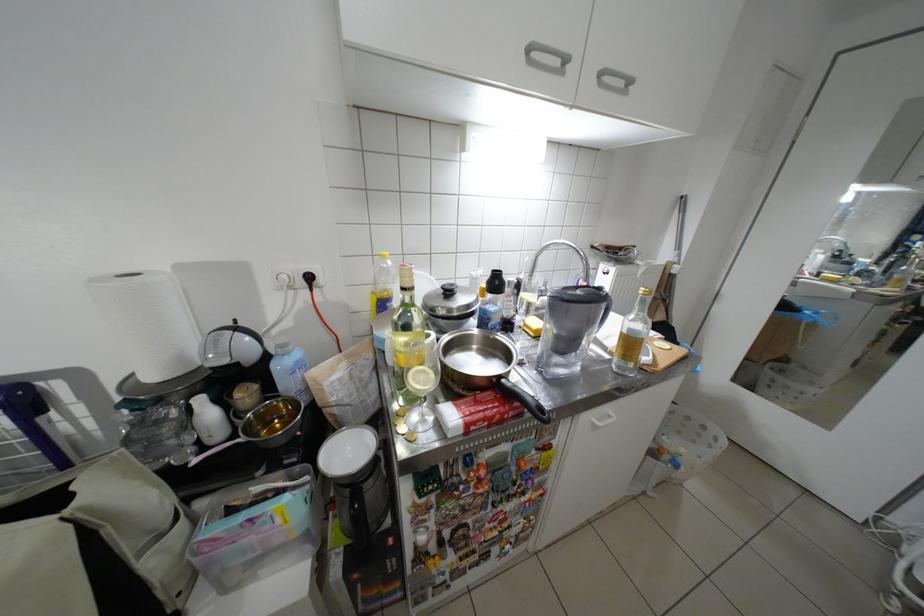
Describe the element at coordinates (407, 336) in the screenshot. The image size is (924, 616). I see `the bottle pump top` at that location.